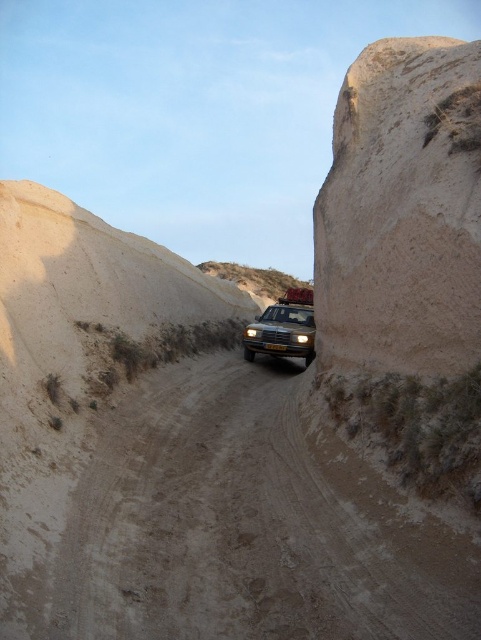
You are a passenger in the matte black car at center driving along the brown sandy dirt track at center. You notice the road ahead is getting steeper. Based on the current position of the car and the road, which direction should you turn to stay on the track?

The brown sandy dirt track at center is below the matte black car at center, so to stay on the track, you should turn downward in the direction of the brown sandy dirt track at center.

You are a driver approaching the rugged dirt road with the matte black car at center. You notice the matte yellow headlight at center is on. Can you determine if the headlight is part of the car or a separate object?

The matte yellow headlight at center is part of the matte black car at center because it is located at the front of the car and serves as its illumination source.